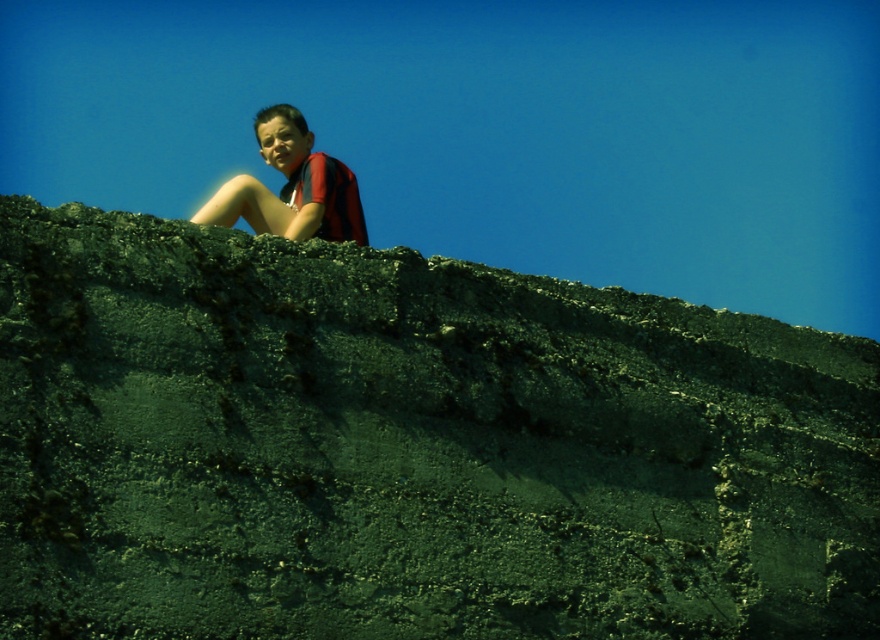
Which is in front, point (321, 628) or point (358, 204)?

Point (321, 628) is more forward.

Looking at this image, is dark gray textured rock at upper center taller than matte red shirt at upper center?

No.

Image resolution: width=880 pixels, height=640 pixels. I want to click on dark gray textured rock at upper center, so click(x=409, y=448).

Image resolution: width=880 pixels, height=640 pixels. I want to click on dark gray textured rock at upper center, so click(x=409, y=448).